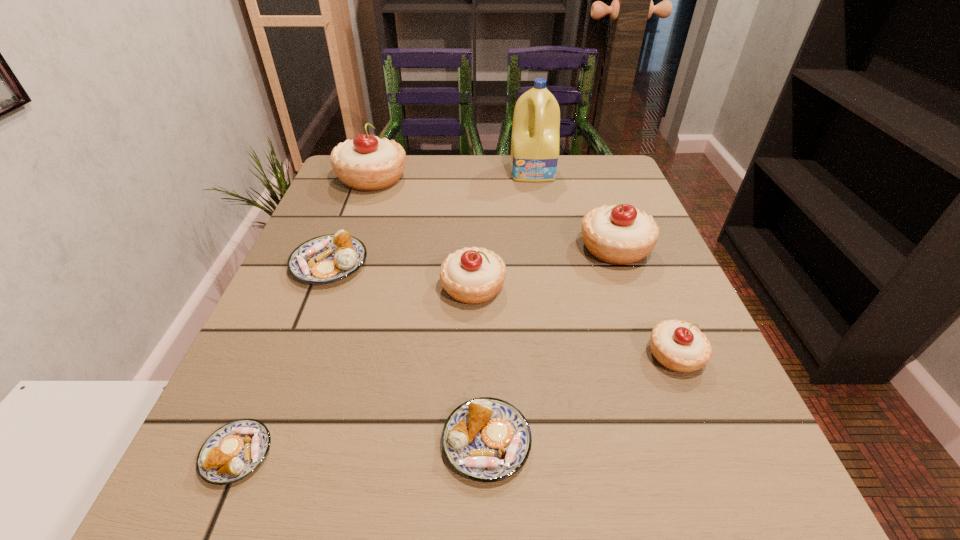
The image size is (960, 540). I want to click on the third shortest object, so click(328, 258).

This screenshot has width=960, height=540. What are the coordinates of `the biggest brown pastry` in the screenshot? It's located at (328, 258).

This screenshot has height=540, width=960. What are the coordinates of `the second smallest brown pastry` in the screenshot? It's located at (486, 439).

Where is `the rightmost brown pastry`? This screenshot has height=540, width=960. the rightmost brown pastry is located at coordinates (486, 439).

At what (x,y) coordinates should I click in order to perform the action: click on the smallest brown pastry. Please return your answer as a coordinate pair (x, y). Looking at the image, I should click on (232, 452).

Find the location of a particular element. The width and height of the screenshot is (960, 540). the shortest pastry is located at coordinates (232, 452).

The image size is (960, 540). Find the location of `free spot located 0.290m on the label of the tallest object`. free spot located 0.290m on the label of the tallest object is located at coordinates (549, 256).

The image size is (960, 540). In order to click on vacant region located on the front of the farthest pastry in this screenshot , I will do `click(336, 278)`.

The image size is (960, 540). In order to click on free space located on the left of the sixth shortest object in this screenshot , I will do `click(516, 248)`.

You are a GUI agent. You are given a task and a screenshot of the screen. Output one action in this format:
    pyautogui.click(x=<x>, y=<y>)
    Task: Click on the free space located 0.260m on the front of the second beige pastry from left to right
    Image resolution: width=960 pixels, height=540 pixels.
    Given the screenshot: What is the action you would take?
    470,452